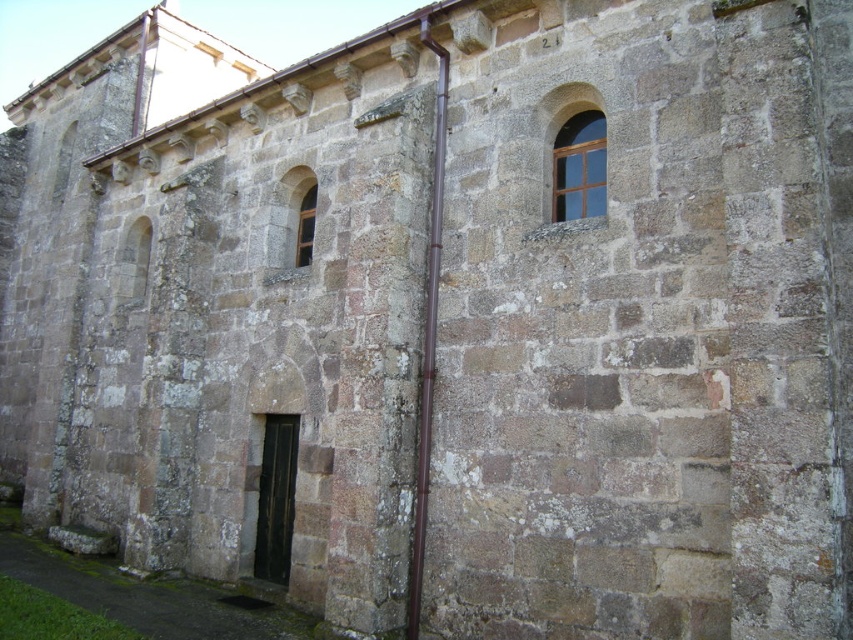
Question: Is clear glass window at upper center bigger than matte stone window at center?

Choices:
 (A) no
 (B) yes

Answer: (B)

Question: Which point is closer to the camera taking this photo?

Choices:
 (A) (300, 243)
 (B) (564, 156)

Answer: (B)

Question: Which object appears closest to the camera in this image?

Choices:
 (A) matte stone window at center
 (B) clear glass window at upper center

Answer: (B)

Question: Is clear glass window at upper center above matte stone window at center?

Choices:
 (A) yes
 (B) no

Answer: (A)

Question: Can you confirm if clear glass window at upper center is positioned to the left of matte stone window at center?

Choices:
 (A) yes
 (B) no

Answer: (B)

Question: Which object appears closest to the camera in this image?

Choices:
 (A) matte stone window at center
 (B) clear glass window at upper center

Answer: (B)